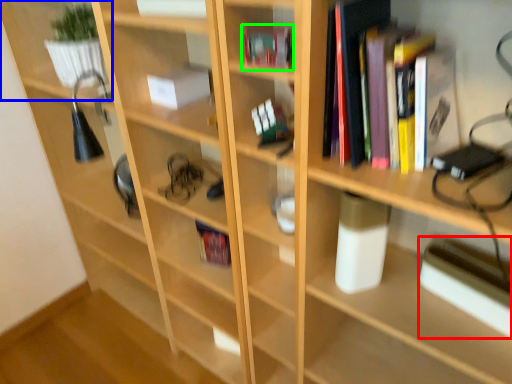
Question: Which object is positioned closest to paperback book (highlighted by a red box)? Select from shelf (highlighted by a blue box) and book (highlighted by a green box).

Choices:
 (A) shelf
 (B) book

Answer: (B)